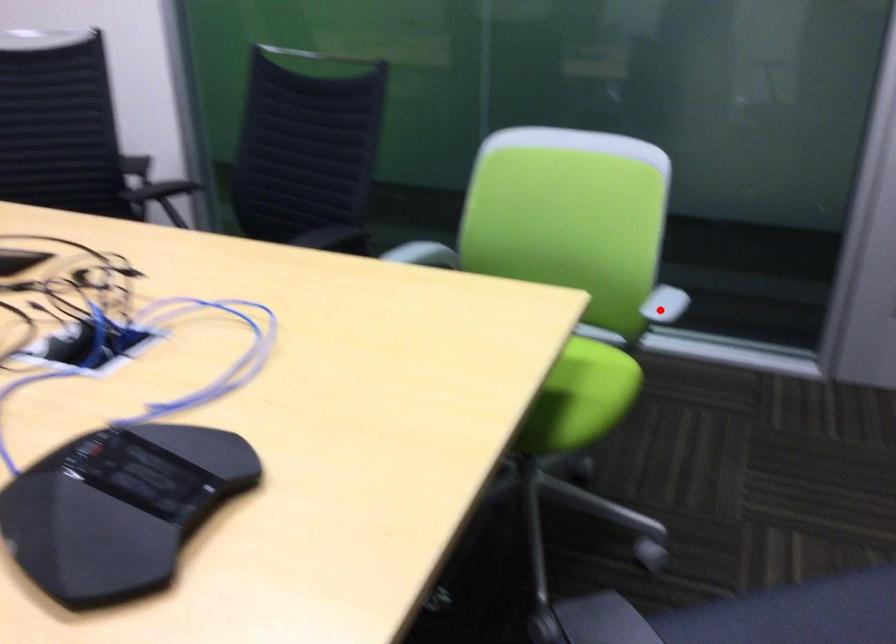
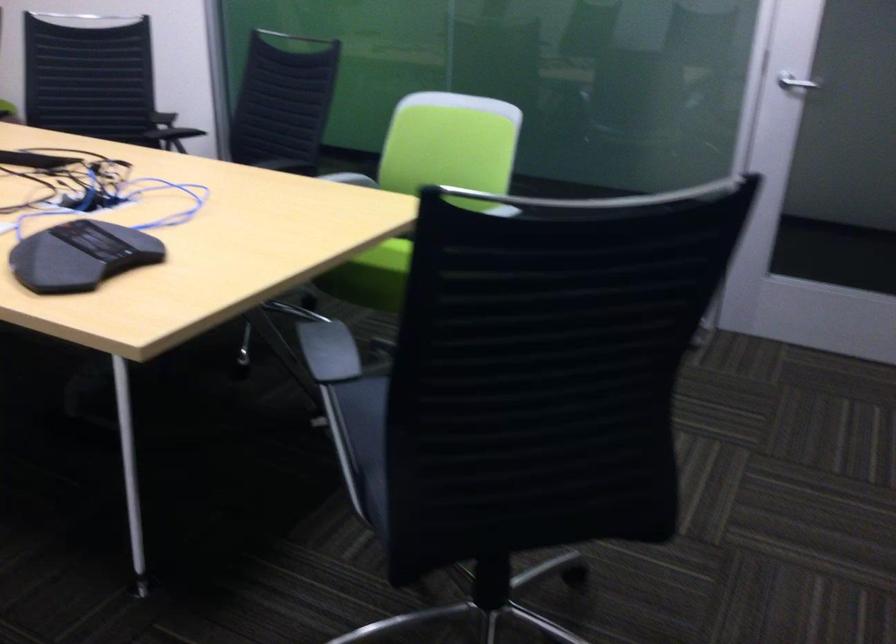
Question: I am providing you with two images of the same scene from different viewpoints. A red point is marked on the first image. At the location where the point appears in image 1, is it still visible in image 2?

Choices:
 (A) Yes
 (B) No

Answer: (B)